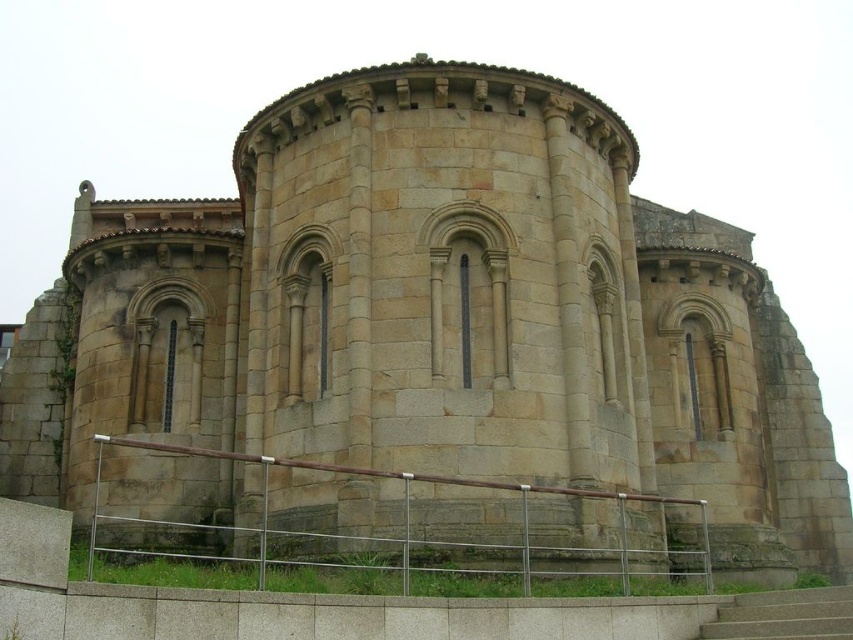
You are a maintenance worker needing to place a 1.2 meter wide equipment box between the silver metallic railing at lower center and the smooth concrete stairs at lower center. Can the equipment box fit in the space between them?

The silver metallic railing at lower center is wider than the smooth concrete stairs at lower center. However, the combined width of both objects would determine the available space between them. Since the exact distance between them isn

You are standing at the entrance of the historic stone building and want to approach the silver metallic railing at lower center. Which direction should you move relative to the smooth concrete stairs at lower center?

The silver metallic railing at lower center is located above the smooth concrete stairs at lower center, so you should move upward towards the silver metallic railing at lower center from the smooth concrete stairs at lower center.